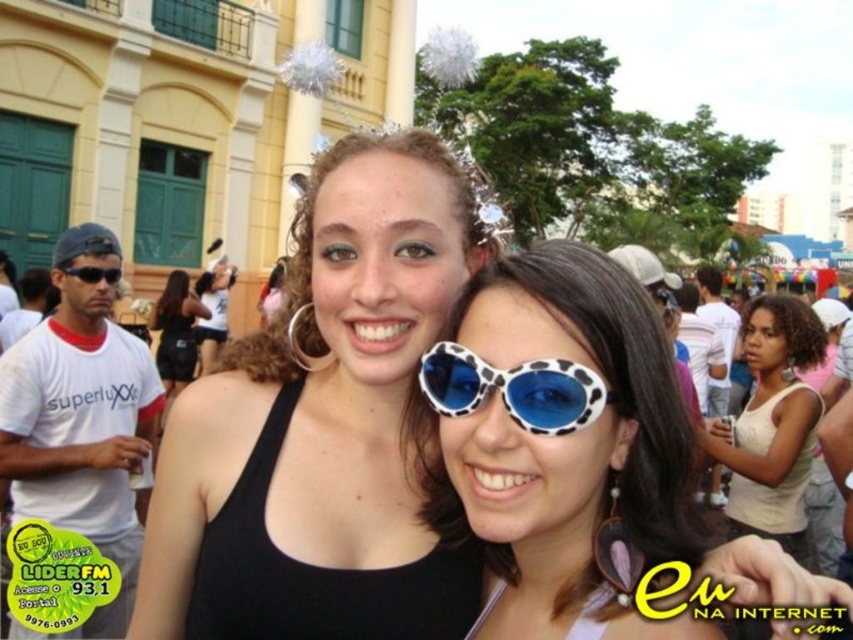
Question: Which object is positioned farthest from the matte black sunglasses at center?

Choices:
 (A) black matte tank top at center
 (B) white leopard print sunglasses at center
 (C) blue leopard print sunglasses at center

Answer: (C)

Question: Can you confirm if blue leopard print sunglasses at center is positioned above matte black sunglasses at center?

Choices:
 (A) yes
 (B) no

Answer: (B)

Question: Which object is positioned closest to the white leopard print sunglasses at center?

Choices:
 (A) black matte tank top at center
 (B) matte black tank top at center

Answer: (A)

Question: Which of the following is the closest to the observer?

Choices:
 (A) (350, 228)
 (B) (109, 275)
 (C) (451, 524)

Answer: (C)

Question: Is black matte tank top at center above white leopard print sunglasses at center?

Choices:
 (A) yes
 (B) no

Answer: (A)

Question: Is matte black tank top at center closer to the viewer compared to matte black sunglasses at center?

Choices:
 (A) no
 (B) yes

Answer: (A)